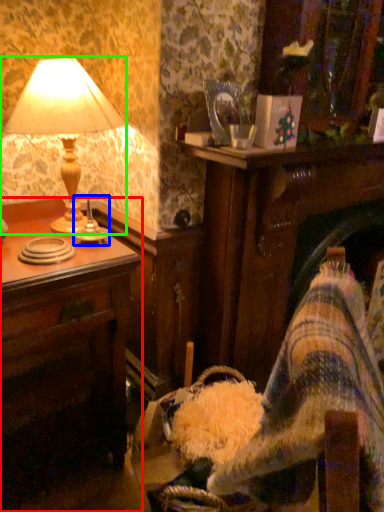
Question: Which object is positioned farthest from desk (highlighted by a red box)? Select from candle holder (highlighted by a blue box) and lamp (highlighted by a green box).

Choices:
 (A) candle holder
 (B) lamp

Answer: (A)